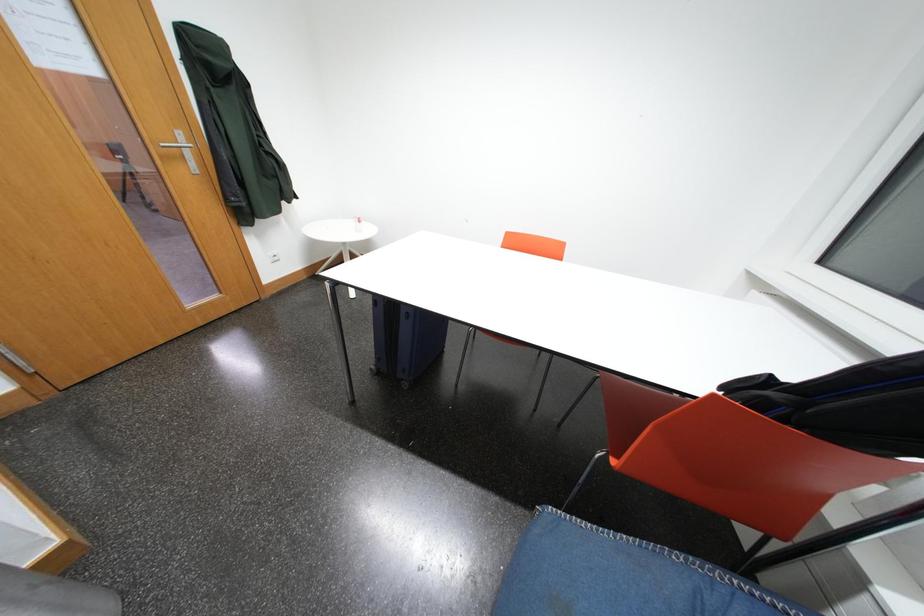
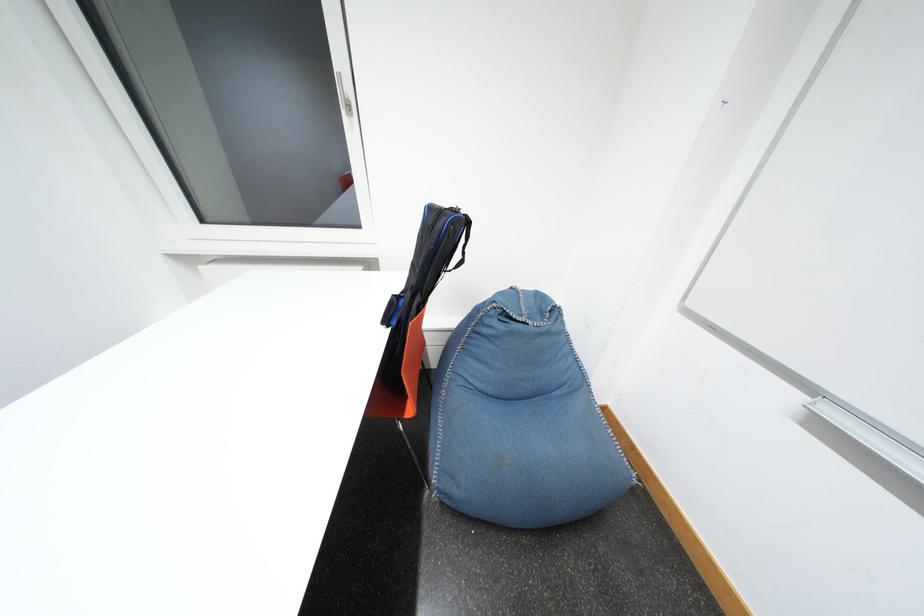
The first image is from the beginning of the video and the second image is from the end. How did the camera likely rotate when shooting the video?

The camera's rotation is toward right-down.